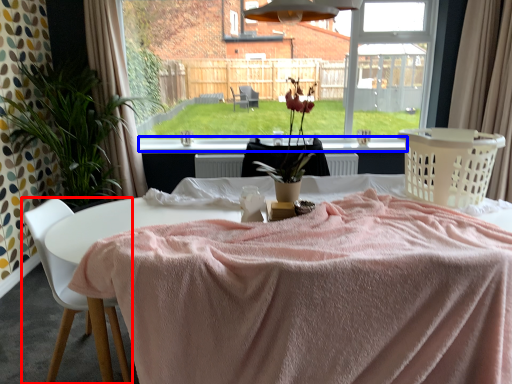
Question: Among these objects, which one is farthest to the camera, chair (highlighted by a red box) or window sill (highlighted by a blue box)?

Choices:
 (A) chair
 (B) window sill

Answer: (B)